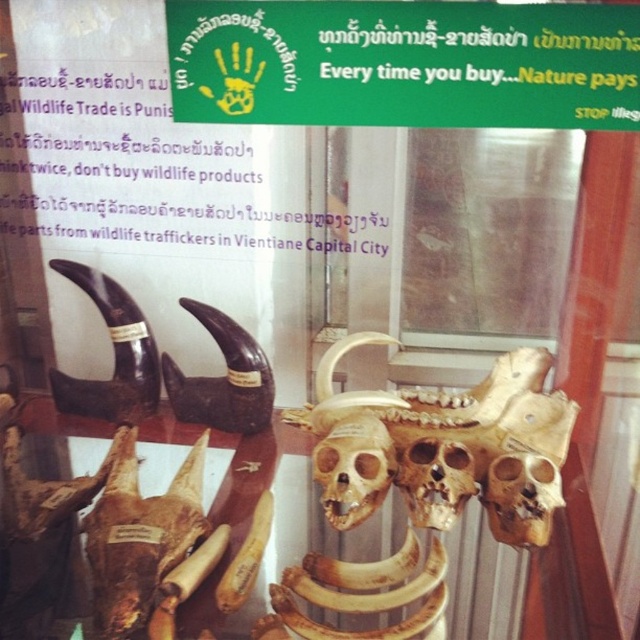
Does golden bone skull at center appear under brown matte skull at center?

No.

Measure the distance from golden bone skull at center to brown matte skull at center.

3.15 inches

This screenshot has height=640, width=640. I want to click on golden bone skull at center, so click(444, 445).